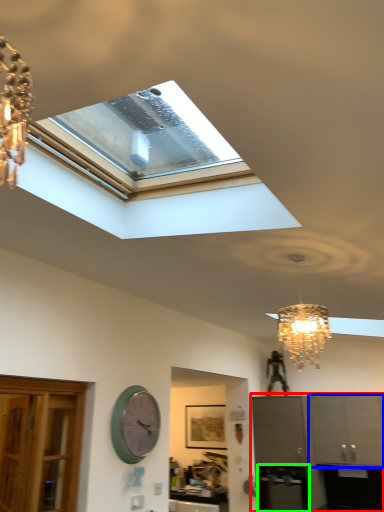
Question: Considering the real-world distances, which object is farthest from cabinetry (highlighted by a red box)? cabinetry (highlighted by a blue box) or appliance (highlighted by a green box)?

Choices:
 (A) cabinetry
 (B) appliance

Answer: (B)